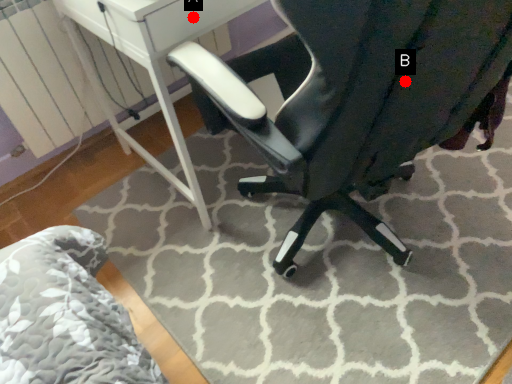
Question: Two points are circled on the image, labeled by A and B beside each circle. Which of the following is the farthest from the observer?

Choices:
 (A) A is further
 (B) B is further

Answer: (A)